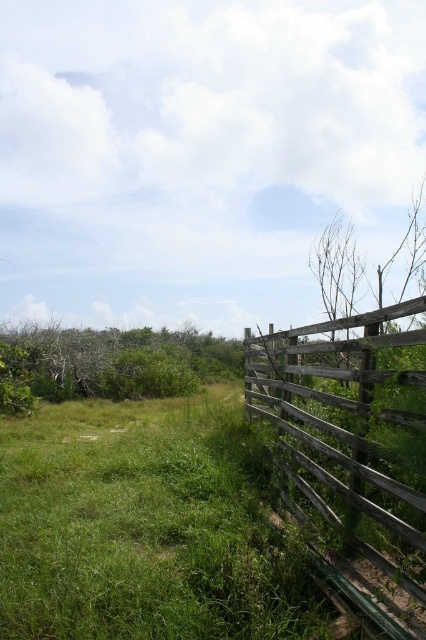
Does weathered wood fence at right appear on the right side of green leafy bush at left?

Correct, you'll find weathered wood fence at right to the right of green leafy bush at left.

Who is more distant from viewer, (302, 404) or (186, 381)?

Point (186, 381)

The width and height of the screenshot is (426, 640). I want to click on weathered wood fence at right, so click(x=351, y=452).